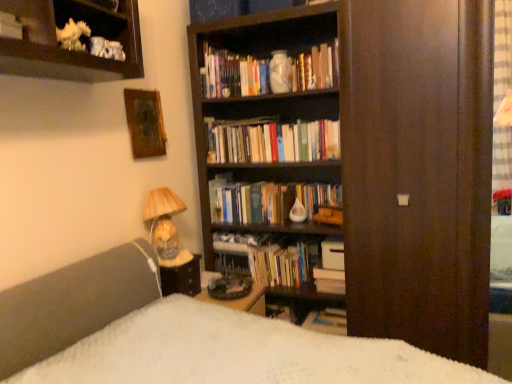
In order to click on vacant space underneath matte ceramic lamp at lower left (from a real-world perspective) in this screenshot , I will do `click(170, 258)`.